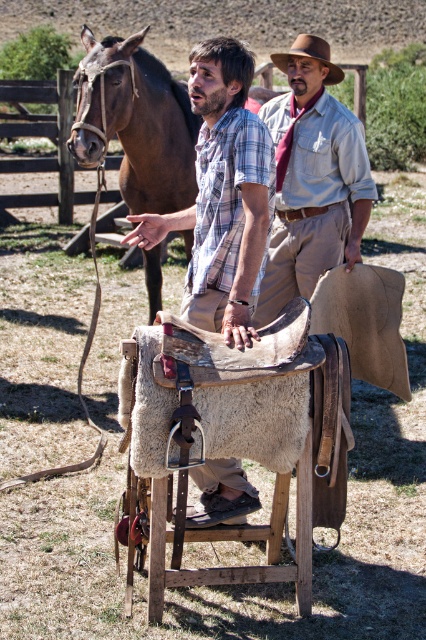
Which of these two, plaid shirt at center or brown leather horse at left, stands shorter?

With less height is brown leather horse at left.

Does plaid shirt at center have a larger size compared to brown leather horse at left?

Actually, plaid shirt at center might be smaller than brown leather horse at left.

The height and width of the screenshot is (640, 426). What do you see at coordinates (221, 195) in the screenshot?
I see `plaid shirt at center` at bounding box center [221, 195].

In order to click on plaid shirt at center in this screenshot , I will do `click(221, 195)`.

Which is more to the right, plaid shirt at center or brown felt cowboy hat at upper center?

Answer: brown felt cowboy hat at upper center

Between point (233, 80) and point (278, 58), which one is positioned in front?

Point (233, 80) is in front.

Between point (190, 516) and point (279, 68), which one is positioned in front?

Positioned in front is point (190, 516).

Where is `plaid shirt at center`? The image size is (426, 640). plaid shirt at center is located at coordinates (221, 195).

Is brown leather saddle at center wider than light brown leather shirt at center?

Yes.

Locate an element on the screen. brown leather saddle at center is located at coordinates (226, 452).

Where is `brown leather saddle at center`? The height and width of the screenshot is (640, 426). brown leather saddle at center is located at coordinates (226, 452).